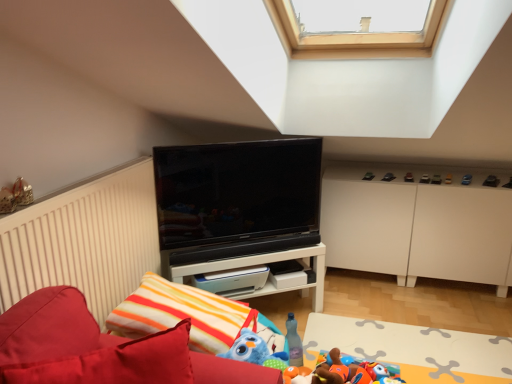
Question: Does white matte cabinet at right have a greater height compared to soft plush toys at lower right?

Choices:
 (A) no
 (B) yes

Answer: (B)

Question: Is white matte cabinet at right touching soft plush toys at lower right?

Choices:
 (A) no
 (B) yes

Answer: (A)

Question: Is the position of white matte cabinet at right more distant than that of soft plush toys at lower right?

Choices:
 (A) yes
 (B) no

Answer: (A)

Question: Is white matte cabinet at right outside soft plush toys at lower right?

Choices:
 (A) yes
 (B) no

Answer: (A)

Question: Is white matte cabinet at right wider than soft plush toys at lower right?

Choices:
 (A) no
 (B) yes

Answer: (A)

Question: From the image's perspective, is white matte cabinet at right on soft plush toys at lower right?

Choices:
 (A) no
 (B) yes

Answer: (B)

Question: Is matte black toy at upper center, the 1th toy in the back-to-front sequence, positioned beyond the bounds of smooth plastic toy car at right, which appears as the seventh toy when viewed from the front?

Choices:
 (A) no
 (B) yes

Answer: (B)

Question: Does matte black toy at upper center, acting as the 6th toy starting from the right, have a smaller size compared to smooth plastic toy car at right, acting as the 6th toy starting from the bottom?

Choices:
 (A) no
 (B) yes

Answer: (A)

Question: Does matte black toy at upper center, the 1th toy in the back-to-front sequence, have a greater height compared to smooth plastic toy car at right, the fourth toy viewed from the left?

Choices:
 (A) yes
 (B) no

Answer: (A)

Question: From a real-world perspective, is matte black toy at upper center, marked as the 8th toy in a front-to-back arrangement, positioned over smooth plastic toy car at right, which is the fifth toy in right-to-left order, based on gravity?

Choices:
 (A) yes
 (B) no

Answer: (A)

Question: Does matte black toy at upper center, the 1th toy in the top-to-bottom sequence, have a lesser width compared to smooth plastic toy car at right, which is the fifth toy in right-to-left order?

Choices:
 (A) no
 (B) yes

Answer: (A)

Question: Considering the relative positions of matte black toy at upper center, the 1th toy in the back-to-front sequence, and smooth plastic toy car at right, arranged as the 2th toy when viewed from the back, in the image provided, is matte black toy at upper center, the 1th toy in the back-to-front sequence, to the left of smooth plastic toy car at right, arranged as the 2th toy when viewed from the back, from the viewer's perspective?

Choices:
 (A) no
 (B) yes

Answer: (B)

Question: Can you confirm if blue plastic toy at upper right, acting as the fifth toy starting from the top, is bigger than white glossy shelf at center?

Choices:
 (A) yes
 (B) no

Answer: (B)